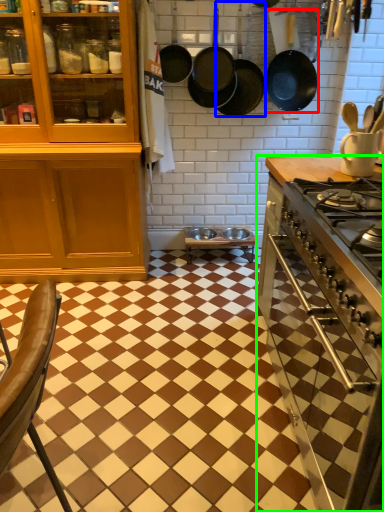
Question: Which is farther away from frying pan (highlighted by a red box)? frying pan (highlighted by a blue box) or countertop (highlighted by a green box)?

Choices:
 (A) frying pan
 (B) countertop

Answer: (B)